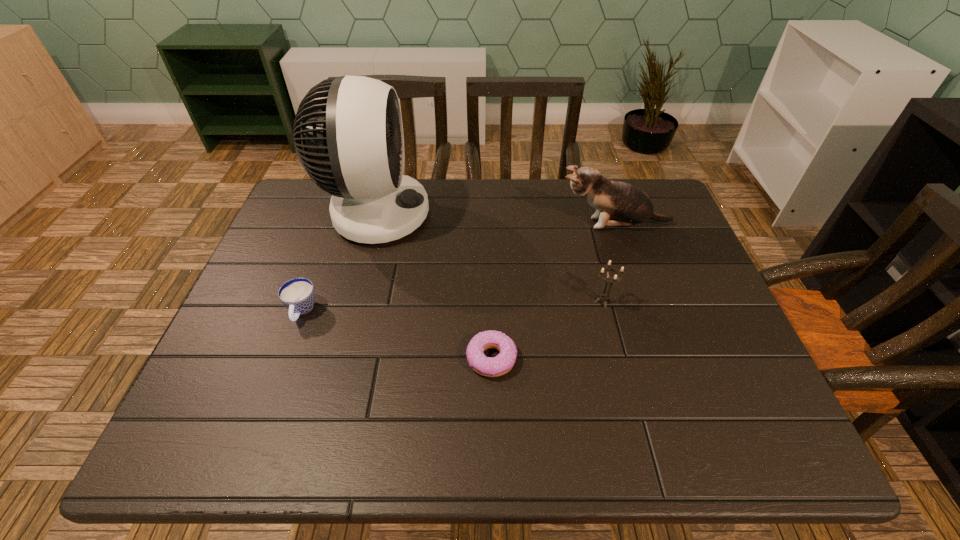
At what (x,y) coordinates should I click in order to perform the action: click on vacant space located 0.250m on the front of the third shortest object. Please return your answer as a coordinate pair (x, y). The image size is (960, 540). Looking at the image, I should click on (631, 409).

Where is `vacant space located 0.060m on the side of the fourth tallest object with the handle`? vacant space located 0.060m on the side of the fourth tallest object with the handle is located at coordinates (287, 350).

Where is `free region located on the back of the shortest object`? This screenshot has height=540, width=960. free region located on the back of the shortest object is located at coordinates (489, 274).

Identify the location of fan situated at the far edge. (348, 131).

The width and height of the screenshot is (960, 540). Find the location of `cat at the far edge`. cat at the far edge is located at coordinates (617, 203).

This screenshot has width=960, height=540. In order to click on fan that is positioned at the left edge in this screenshot , I will do `click(348, 131)`.

Locate an element on the screen. This screenshot has height=540, width=960. cup present at the left edge is located at coordinates (298, 295).

Where is `object present at the right edge`? object present at the right edge is located at coordinates (617, 203).

The height and width of the screenshot is (540, 960). What are the coordinates of `object positioned at the far left corner` in the screenshot? It's located at (348, 131).

Image resolution: width=960 pixels, height=540 pixels. I want to click on object that is at the far right corner, so click(617, 203).